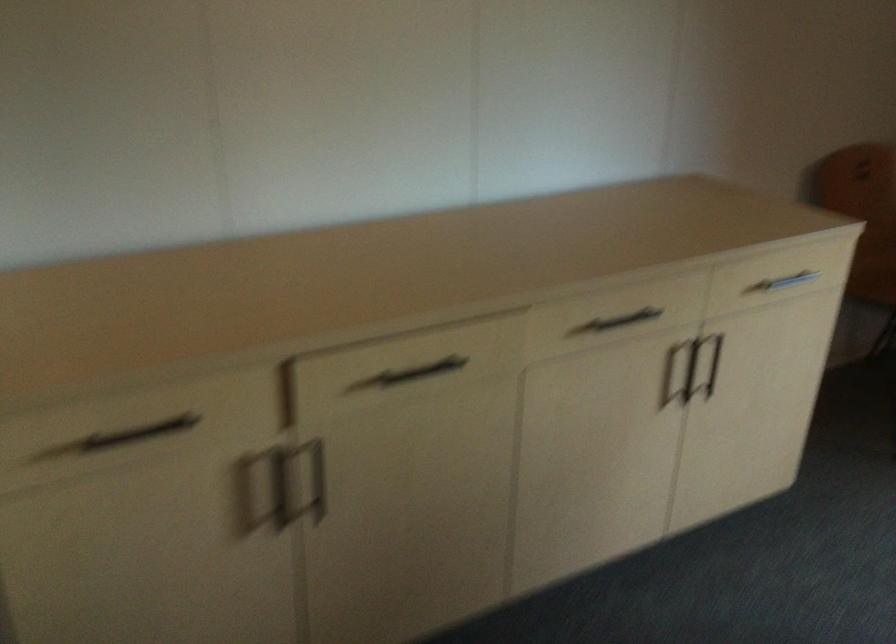
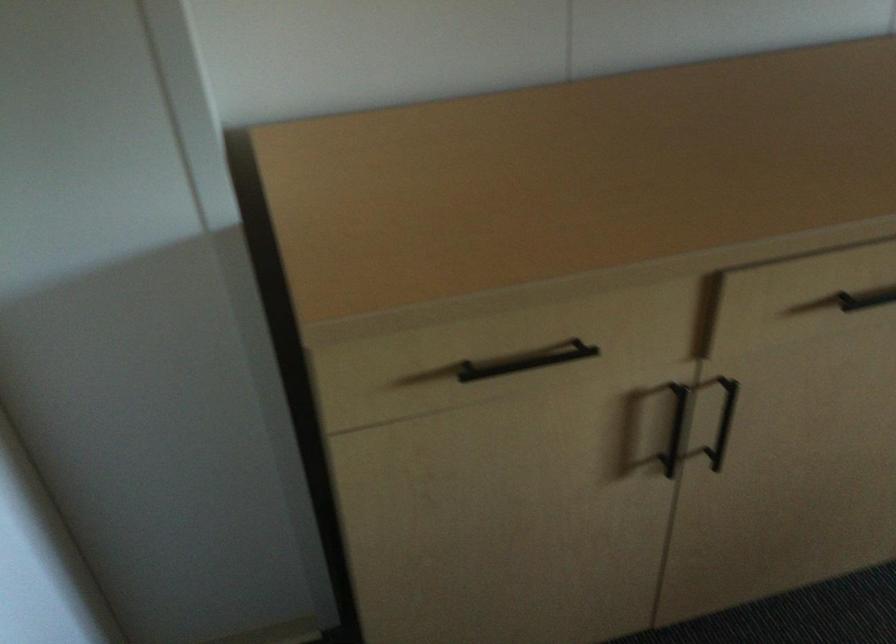
Where in the second image is the point corresponding to the point at 147,430 from the first image?

(526, 361)